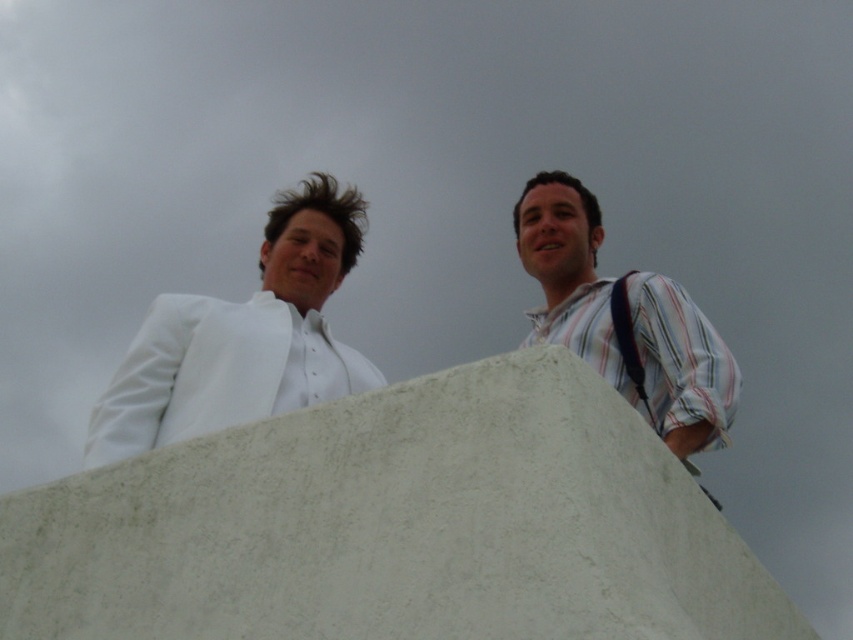
Between white rough concrete at center and striped cotton shirt at upper right, which one has less height?

With less height is white rough concrete at center.

Locate an element on the screen. white rough concrete at center is located at coordinates (396, 525).

Where is `white rough concrete at center`? white rough concrete at center is located at coordinates (396, 525).

Does white matte suit at upper left have a greater width compared to black fabric strap at right?

Yes.

Between white matte suit at upper left and black fabric strap at right, which one has more height?

With more height is white matte suit at upper left.

At what (x,y) coordinates should I click in order to perform the action: click on white matte suit at upper left. Please return your answer as a coordinate pair (x, y). Image resolution: width=853 pixels, height=640 pixels. Looking at the image, I should click on 242,337.

Where is `white matte suit at upper left`? white matte suit at upper left is located at coordinates (242, 337).

Measure the distance between white rough concrete at center and camera.

white rough concrete at center and camera are 96.52 feet apart.

Find the location of a particular element. The height and width of the screenshot is (640, 853). white rough concrete at center is located at coordinates (396, 525).